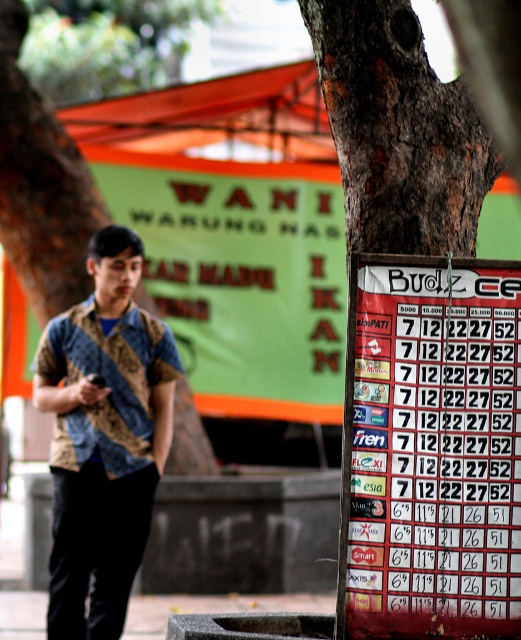
Consider the image. You are standing at the point with coordinates point (101, 419) and want to walk towards the point (399, 124). Which direction should you move to get closer to the destination?

You should move towards the point (399, 124), which is closer to the viewer than point (101, 419). Since point (399, 124) is closer, you should move forward in the direction towards it.

You are a fashion designer analyzing the scene. You see a point at coordinate (104,436). What object is located at that point?

The point at coordinate (104,436) corresponds to the batik shirt at left.